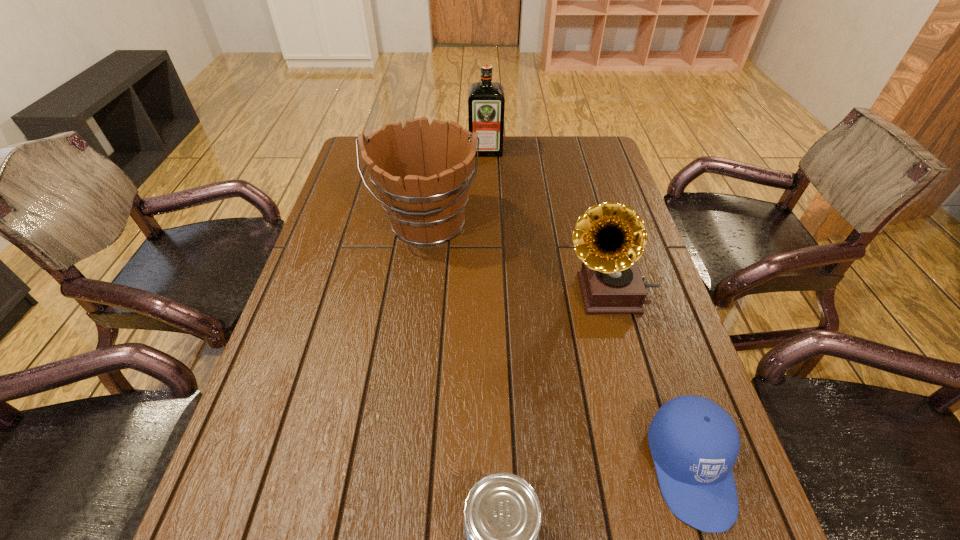
Locate an element on the screen. the farthest object is located at coordinates (486, 102).

You are a GUI agent. You are given a task and a screenshot of the screen. Output one action in this format:
    pyautogui.click(x=<x>, y=<y>)
    Task: Click on the second farthest object
    The image size is (960, 540).
    Given the screenshot: What is the action you would take?
    pyautogui.click(x=422, y=174)

Image resolution: width=960 pixels, height=540 pixels. In order to click on phonograph record in this screenshot , I will do `click(609, 238)`.

You are a GUI agent. You are given a task and a screenshot of the screen. Output one action in this format:
    pyautogui.click(x=<x>, y=<y>)
    Task: Click on the cap
    The image size is (960, 540).
    Given the screenshot: What is the action you would take?
    pyautogui.click(x=694, y=443)

What are the coordinates of `free location located 0.110m on the front label of the liquor` in the screenshot? It's located at (486, 175).

At what (x,y) coordinates should I click in order to perform the action: click on free space located with the handle on the wine bucket. Please return your answer as a coordinate pair (x, y). The image size is (960, 540). Looking at the image, I should click on (413, 328).

Identify the location of vacant space located 0.280m from the horn of the phonograph record. The width and height of the screenshot is (960, 540). (449, 292).

You are a GUI agent. You are given a task and a screenshot of the screen. Output one action in this format:
    pyautogui.click(x=<x>, y=<y>)
    Task: Click on the vacant region located 0.050m from the horn of the phonograph record
    This screenshot has height=540, width=960.
    Given the screenshot: What is the action you would take?
    pyautogui.click(x=541, y=292)

At what (x,y) coordinates should I click in order to perform the action: click on vacant position located 0.120m from the horn of the phonograph record. Please return your answer as a coordinate pair (x, y). This screenshot has height=540, width=960. Looking at the image, I should click on (514, 292).

This screenshot has width=960, height=540. Identify the location of object positioned at the far edge. (486, 102).